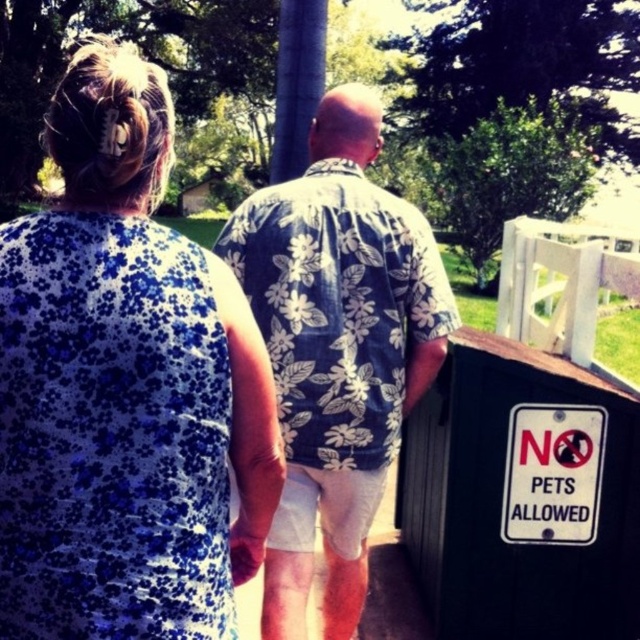
Can you confirm if blue floral dress at upper left is positioned below floral fabric shirt at center?

No.

Who is taller, blue floral dress at upper left or floral fabric shirt at center?

With more height is floral fabric shirt at center.

Image resolution: width=640 pixels, height=640 pixels. In order to click on blue floral dress at upper left in this screenshot , I will do `click(124, 388)`.